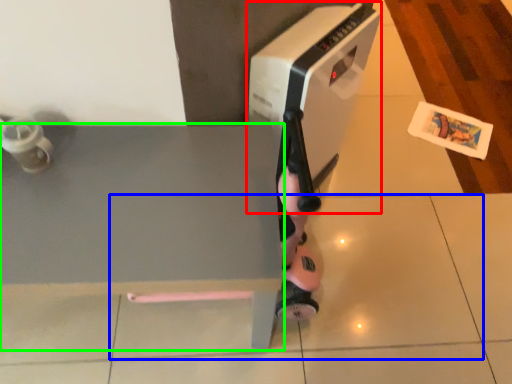
Question: Which object is the farthest from home appliance (highlighted by a red box)? Choose among these: tile (highlighted by a blue box) or table (highlighted by a green box).

Choices:
 (A) tile
 (B) table

Answer: (A)